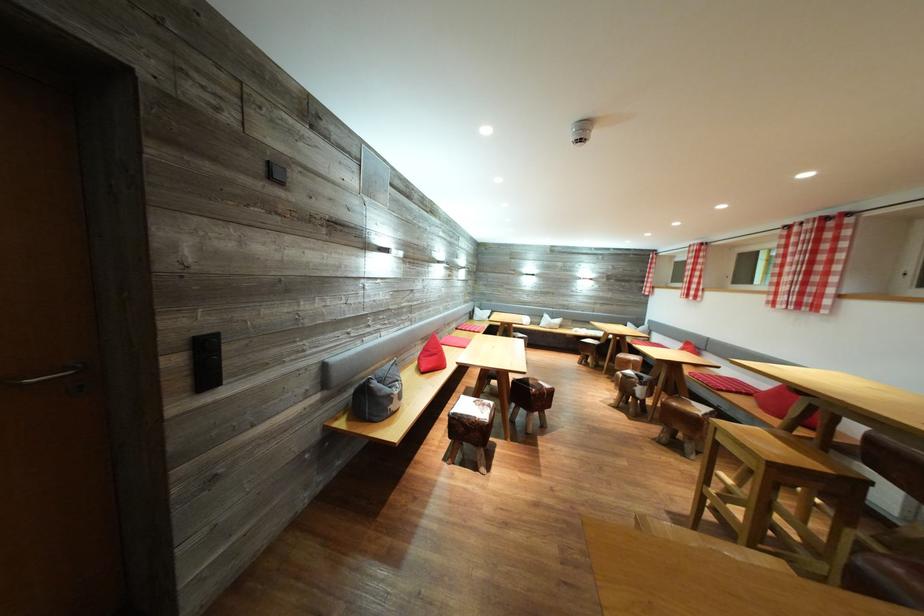
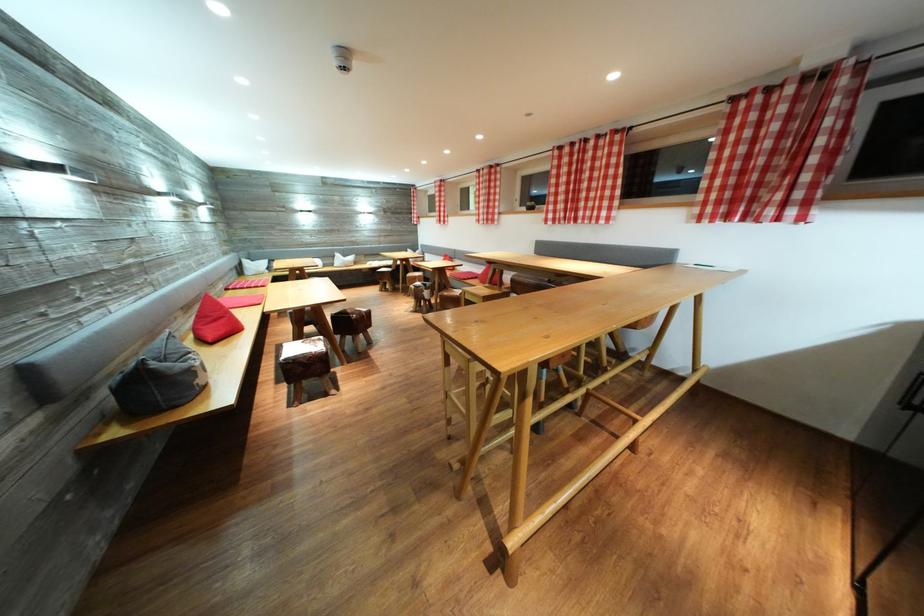
Where in the second image is the point corresponding to point 593,362 from the first image?

(393, 289)